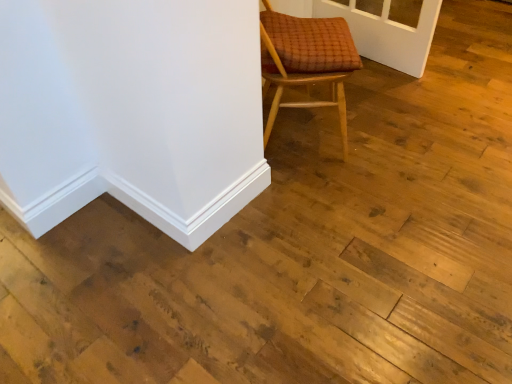
Where is `free point in front of brown woven cushioned chair at upper right`? This screenshot has height=384, width=512. free point in front of brown woven cushioned chair at upper right is located at coordinates (328, 196).